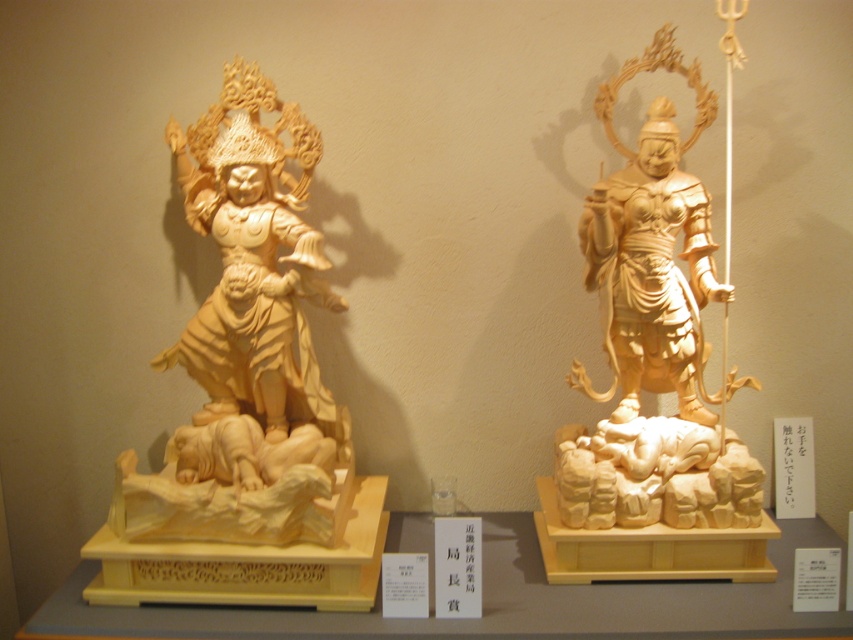
You are a museum visitor who wants to take a photo of both the light wood statue at left and the light wood statue at center. Since you can only focus on one statue at a time, which statue should you position closer to the camera to ensure both are in focus?

You should position the light wood statue at left closer to the camera because it is on the left side of the light wood statue at center, so adjusting the focus on the closer statue will help both be in focus.